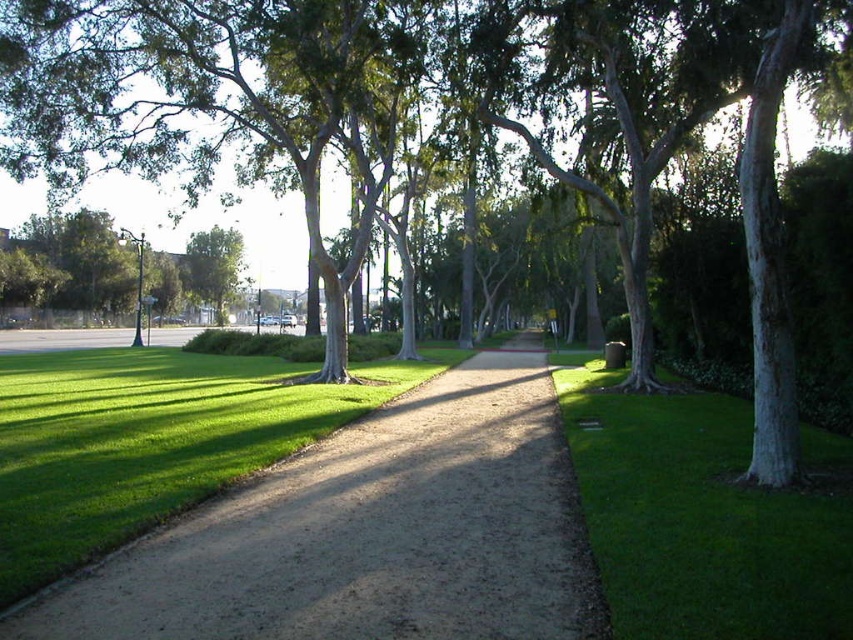
Who is lower down, dirt path at center or green leafy tree at center?

dirt path at center is below.

Who is shorter, dirt path at center or green leafy tree at center?

Standing shorter between the two is dirt path at center.

I want to click on dirt path at center, so click(370, 532).

Is dirt path at center positioned in front of green grass at lower right?

That is False.

Which is more to the right, dirt path at center or green grass at lower right?

From the viewer's perspective, green grass at lower right appears more on the right side.

The height and width of the screenshot is (640, 853). Describe the element at coordinates (370, 532) in the screenshot. I see `dirt path at center` at that location.

The height and width of the screenshot is (640, 853). I want to click on dirt path at center, so click(370, 532).

Which of these two, green grass at lower right or green leafy tree at left, stands shorter?

green grass at lower right is shorter.

Which is in front, point (746, 490) or point (186, 280)?

Point (746, 490)

Find the location of a particular element. This screenshot has height=640, width=853. green grass at lower right is located at coordinates (698, 518).